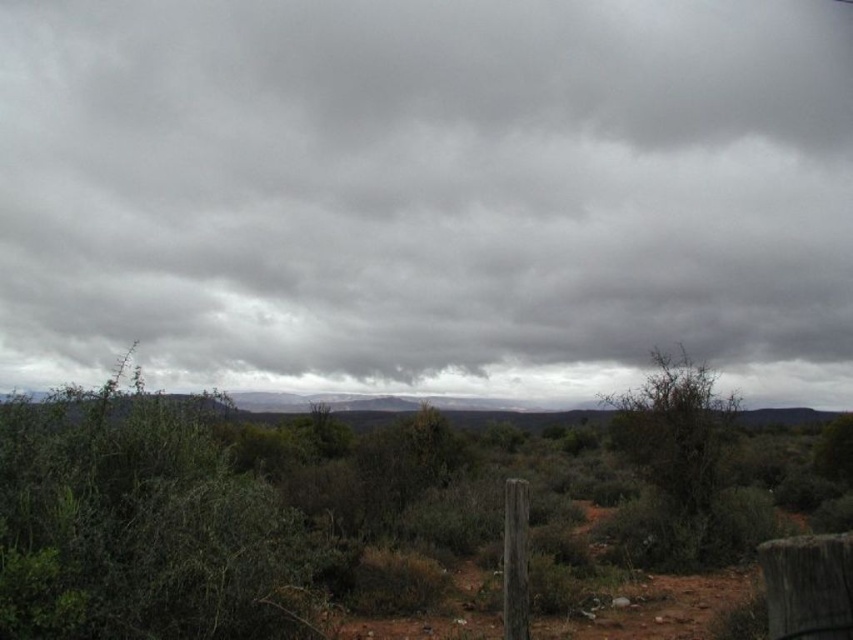
Question: Among these points, which one is nearest to the camera?

Choices:
 (A) (746, 168)
 (B) (693, 483)

Answer: (B)

Question: Which point is farther to the camera?

Choices:
 (A) (244, 256)
 (B) (682, 456)

Answer: (A)

Question: Can you confirm if gray matte cloud at upper center is positioned above green leafy bush at center?

Choices:
 (A) no
 (B) yes

Answer: (B)

Question: Considering the relative positions of gray matte cloud at upper center and green leafy bush at center in the image provided, where is gray matte cloud at upper center located with respect to green leafy bush at center?

Choices:
 (A) below
 (B) above

Answer: (B)

Question: Does gray matte cloud at upper center appear on the right side of green leafy bush at center?

Choices:
 (A) yes
 (B) no

Answer: (B)

Question: Among these objects, which one is nearest to the camera?

Choices:
 (A) gray matte cloud at upper center
 (B) green leafy bush at center

Answer: (A)